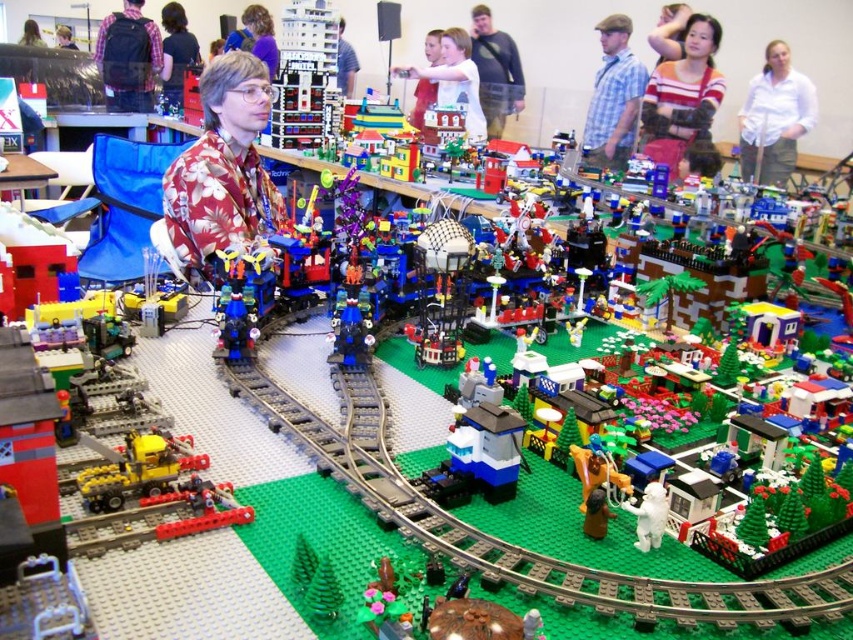
What is located at the coordinates point (495, 70) in the Lego diorama?

The matte gray shirt at upper center is located at point (495, 70).

You are standing 3 meters away from the Lego diorama. There is a point at coordinates point (489, 120) in the diorama. Can you reach this point without moving closer than 3 meters?

The distance of point (489, 120) from viewer is 3.42 meters, so you cannot reach this point without moving closer than 3 meters because the point is farther away than your current position.